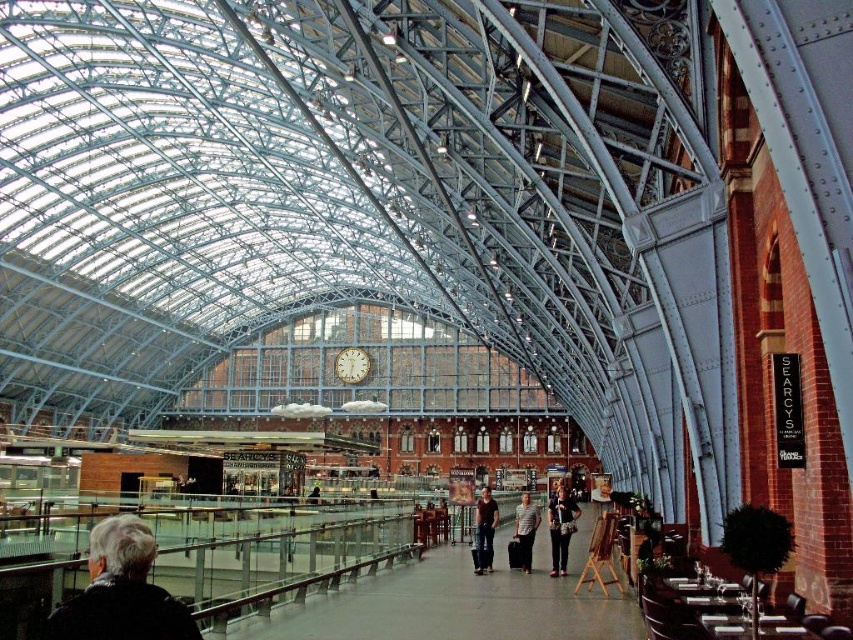
Question: Estimate the real-world distances between objects in this image. Which object is closer to the dark brown leather pants at center?

Choices:
 (A) gold textured clock at center
 (B) gray fabric jacket at lower left
 (C) striped shirt at center

Answer: (C)

Question: Which point is closer to the camera?

Choices:
 (A) dark brown leather pants at center
 (B) gray fabric jacket at lower left
 (C) matte black jacket at center

Answer: (B)

Question: Is dark brown leather pants at center bigger than striped shirt at center?

Choices:
 (A) yes
 (B) no

Answer: (B)

Question: Can you confirm if gray fabric jacket at lower left is wider than matte black jacket at center?

Choices:
 (A) yes
 (B) no

Answer: (A)

Question: Based on their relative distances, which object is nearer to the dark brown leather pants at center?

Choices:
 (A) gold textured clock at center
 (B) gray fabric jacket at lower left
 (C) matte black jacket at center
 (D) striped shirt at center

Answer: (D)

Question: Does striped shirt at center appear on the left side of gold textured clock at center?

Choices:
 (A) yes
 (B) no

Answer: (B)